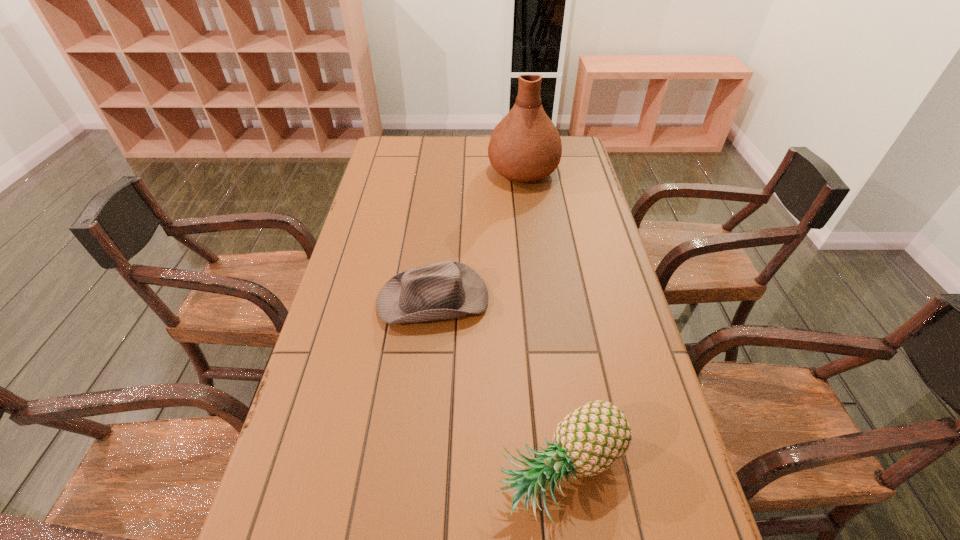
Locate an element on the screen. vacant position in the image that satisfies the following two spatial constraints: 1. on the front side of the nearest object; 2. on the left side of the fedora is located at coordinates (416, 474).

Locate an element on the screen. vacant space that satisfies the following two spatial constraints: 1. on the front side of the leftmost object; 2. on the right side of the pineapple is located at coordinates (416, 474).

The height and width of the screenshot is (540, 960). Identify the location of vacant space that satisfies the following two spatial constraints: 1. on the front side of the fedora; 2. on the right side of the nearest object. point(416,474).